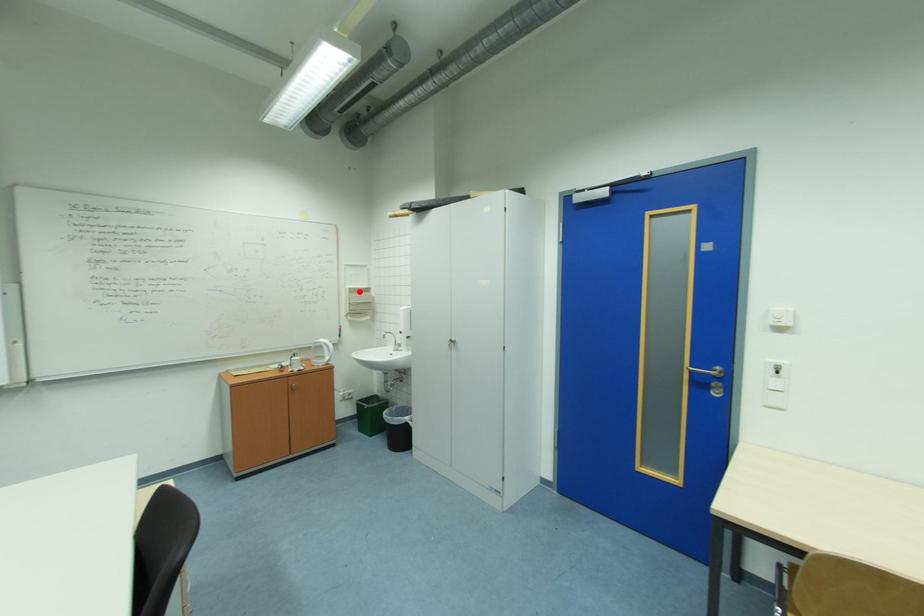
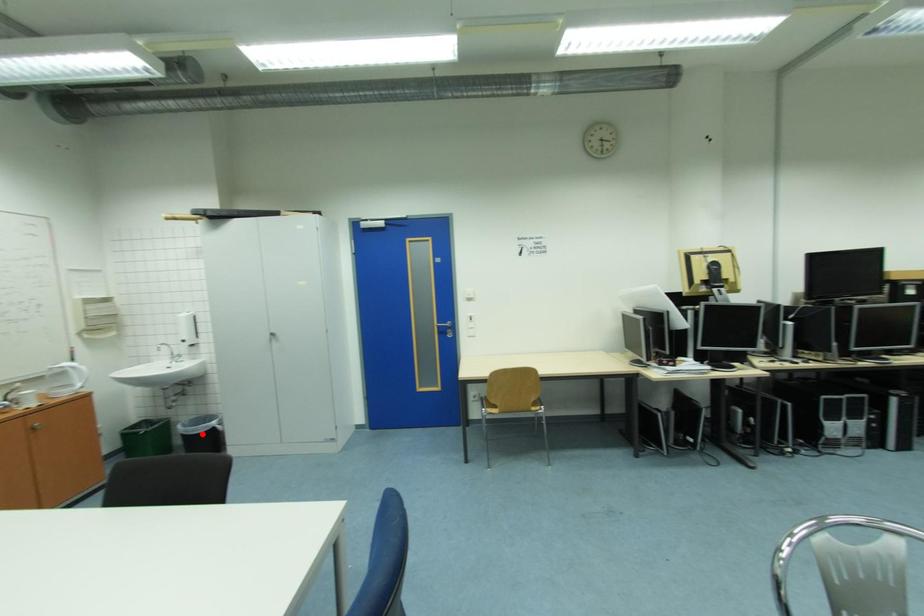
I am providing you with two images of the same scene from different viewpoints. A red point is marked on the first image and another point is marked on the second image. Are the points marked in image1 and image2 representing the same 3D position?

No